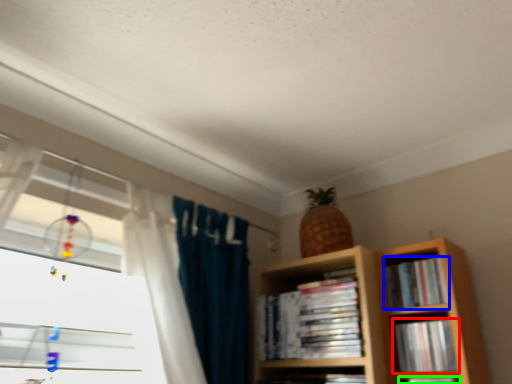
Question: Considering the real-world distances, which object is closest to book (highlighted by a red box)? book (highlighted by a blue box) or book (highlighted by a green box).

Choices:
 (A) book
 (B) book

Answer: (B)